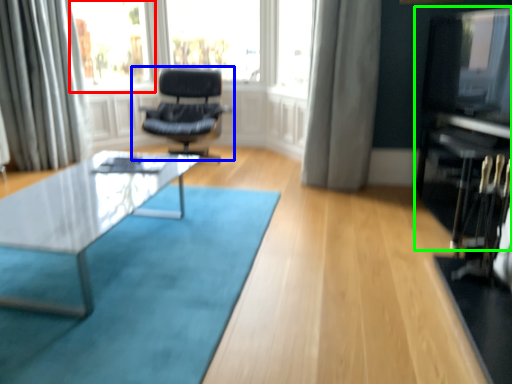
Question: Based on their relative distances, which object is farther from bay window (highlighted by a red box)? Choose from chair (highlighted by a blue box) and entertainment center (highlighted by a green box).

Choices:
 (A) chair
 (B) entertainment center

Answer: (B)